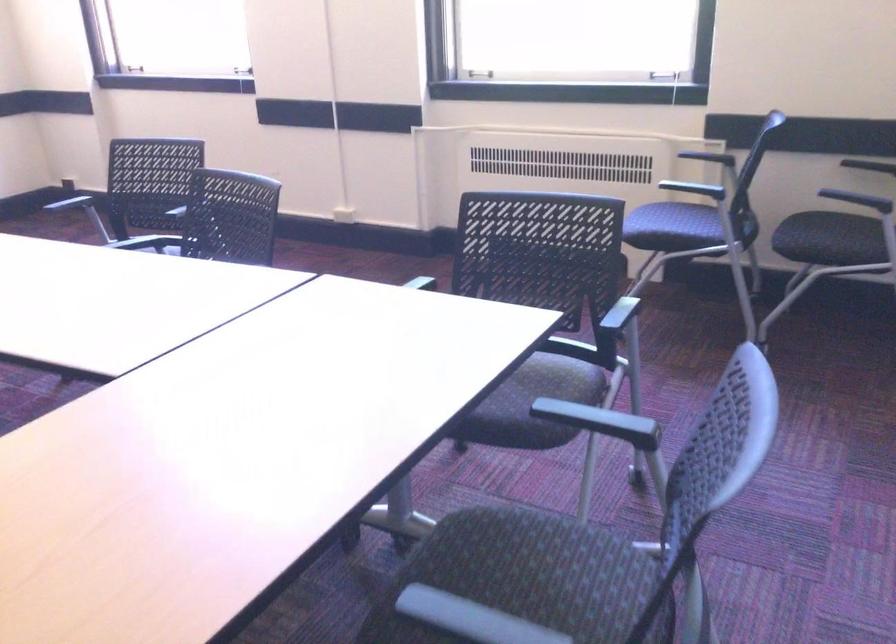
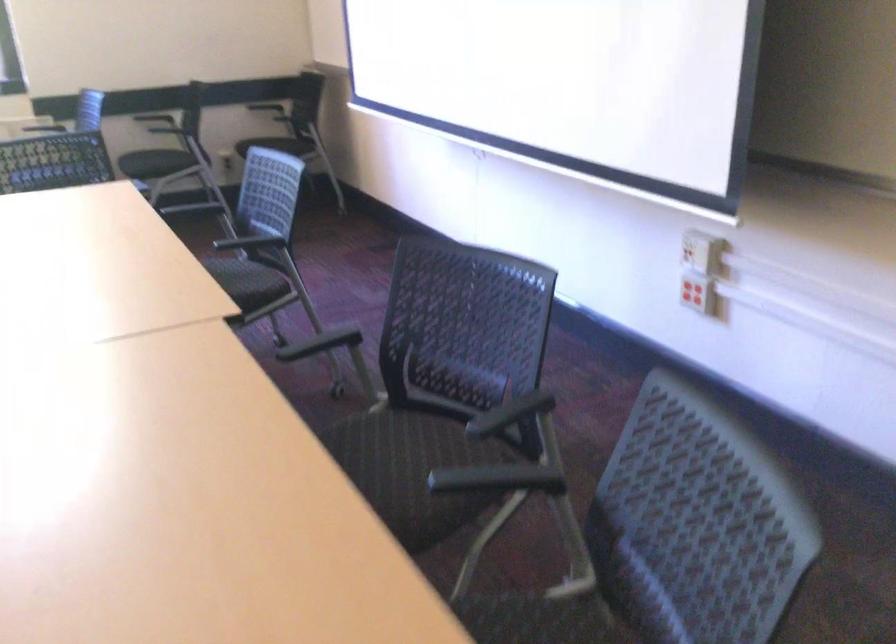
Question: I am providing you with two images of the same scene from different viewpoints. After the viewpoint changes to image2, which objects are now occluded?

Choices:
 (A) black chair armrest
 (B) black electric kettle handle
 (C) black chair sitting surface
 (D) dark chair surface

Answer: (D)